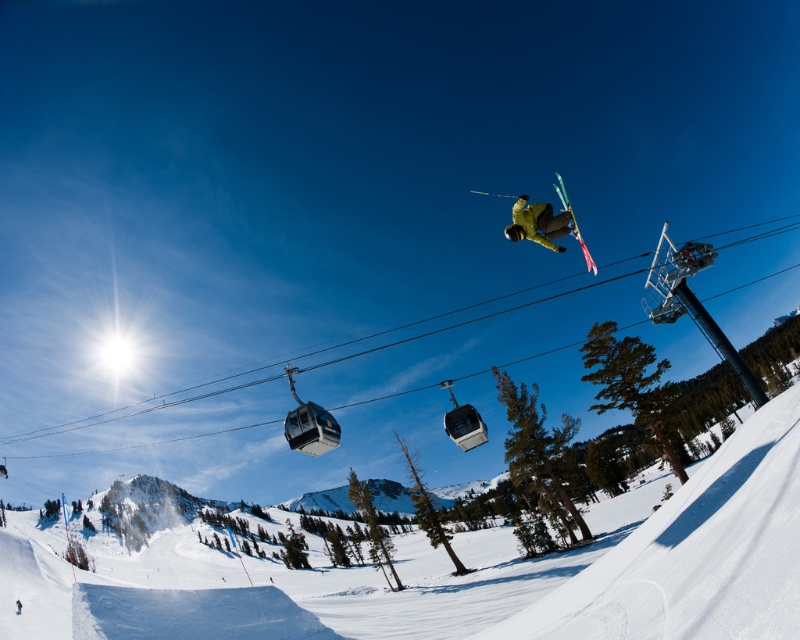
Question: Is metallic cable car at center positioned before yellow matte snowboarder at center?

Choices:
 (A) no
 (B) yes

Answer: (A)

Question: Is metallic cable car at center bigger than yellow matte snowboarder at center?

Choices:
 (A) yes
 (B) no

Answer: (A)

Question: Which point is closer to the camera?

Choices:
 (A) (293, 416)
 (B) (517, 237)

Answer: (B)

Question: Which object is farther from the camera taking this photo?

Choices:
 (A) metallic cable car at center
 (B) yellow matte snowboarder at center

Answer: (A)

Question: Is the position of metallic cable car at center less distant than that of yellow matte snowboarder at center?

Choices:
 (A) no
 (B) yes

Answer: (A)